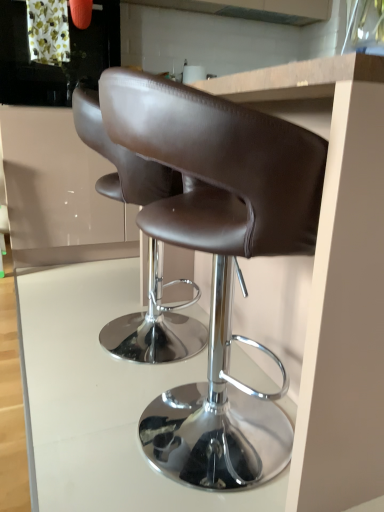
Question: From a real-world perspective, is white glossy table at center physically above matte white cabinet at upper left?

Choices:
 (A) no
 (B) yes

Answer: (A)

Question: Is white glossy table at center bigger than matte white cabinet at upper left?

Choices:
 (A) no
 (B) yes

Answer: (A)

Question: Is white glossy table at center to the right of matte white cabinet at upper left from the viewer's perspective?

Choices:
 (A) yes
 (B) no

Answer: (A)

Question: Is there a large distance between white glossy table at center and matte white cabinet at upper left?

Choices:
 (A) no
 (B) yes

Answer: (A)

Question: Can you confirm if white glossy table at center is wider than matte white cabinet at upper left?

Choices:
 (A) no
 (B) yes

Answer: (B)

Question: In the image, is metallic gray exhaust hood at upper center on the left side or the right side of brown leather stool at center, acting as the second chair starting from the front?

Choices:
 (A) right
 (B) left

Answer: (A)

Question: Considering their positions, is metallic gray exhaust hood at upper center located in front of or behind brown leather stool at center, which appears as the 1th chair when viewed from the back?

Choices:
 (A) front
 (B) behind

Answer: (B)

Question: Looking at the image, does metallic gray exhaust hood at upper center seem bigger or smaller compared to brown leather stool at center, which appears as the 1th chair when viewed from the back?

Choices:
 (A) small
 (B) big

Answer: (A)

Question: From the image's perspective, is metallic gray exhaust hood at upper center located above or below brown leather stool at center, which appears as the 1th chair when viewed from the back?

Choices:
 (A) above
 (B) below

Answer: (A)

Question: In terms of width, does matte white cabinet at upper left look wider or thinner when compared to brown leather stool at center, acting as the second chair starting from the front?

Choices:
 (A) wide
 (B) thin

Answer: (A)

Question: In the image, is matte white cabinet at upper left on the left side or the right side of brown leather stool at center, acting as the second chair starting from the front?

Choices:
 (A) right
 (B) left

Answer: (B)

Question: Is matte white cabinet at upper left inside the boundaries of brown leather stool at center, which appears as the 1th chair when viewed from the back, or outside?

Choices:
 (A) outside
 (B) inside

Answer: (A)

Question: From their relative heights in the image, would you say matte white cabinet at upper left is taller or shorter than brown leather stool at center, acting as the second chair starting from the front?

Choices:
 (A) tall
 (B) short

Answer: (A)

Question: Is brown leather stool at center, which appears as the second chair when viewed from the back, bigger or smaller than matte white cabinet at upper left?

Choices:
 (A) small
 (B) big

Answer: (A)

Question: Visually, is brown leather stool at center, which appears as the second chair when viewed from the back, positioned to the left or to the right of matte white cabinet at upper left?

Choices:
 (A) left
 (B) right

Answer: (B)